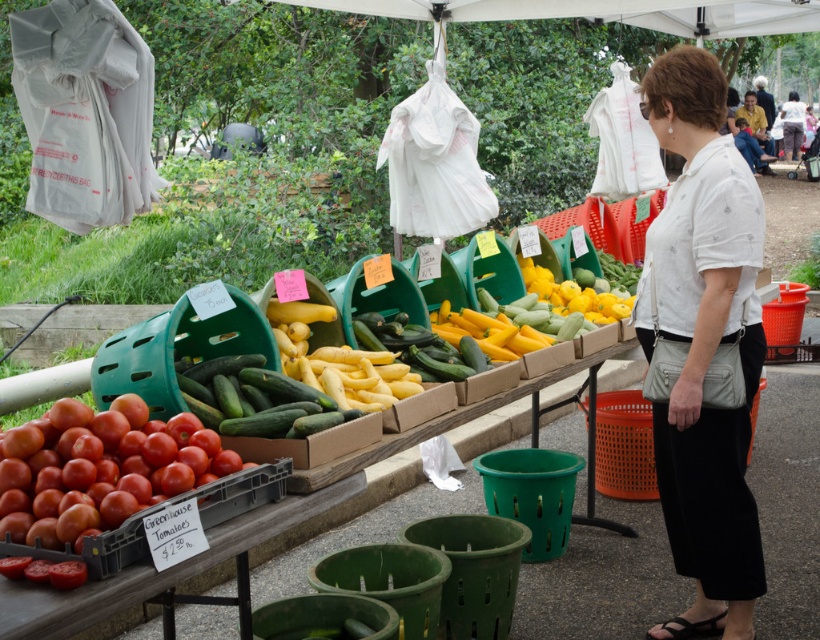
Between yellow matte zucchini at center and matte white blouse at center, which one has more height?

matte white blouse at center

Can you confirm if yellow matte zucchini at center is bigger than matte white blouse at center?

Incorrect, yellow matte zucchini at center is not larger than matte white blouse at center.

Is point (600, 300) farther from viewer compared to point (793, 122)?

No, it is in front of (793, 122).

Locate an element on the screen. This screenshot has width=820, height=640. yellow matte zucchini at center is located at coordinates (577, 292).

Is white printed blouse at center above shiny red tomatoes at lower left?

Indeed, white printed blouse at center is positioned over shiny red tomatoes at lower left.

Who is more forward, (727, 572) or (83, 460)?

Point (83, 460) is more forward.

Is point (693, 440) positioned behind point (221, 472)?

Yes, it is behind point (221, 472).

Locate an element on the screen. white printed blouse at center is located at coordinates (704, 346).

From the picture: Which is more to the right, white printed blouse at center or green matte cucumber at center?

white printed blouse at center is more to the right.

Is white printed blouse at center above green matte cucumber at center?

Yes, white printed blouse at center is above green matte cucumber at center.

Is point (663, 264) closer to viewer compared to point (258, 371)?

No, it is not.

Find the location of a particular element. white printed blouse at center is located at coordinates (704, 346).